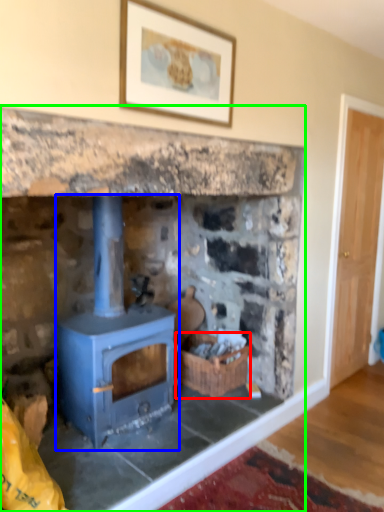
Question: Considering the real-world distances, which object is closest to basket (highlighted by a red box)? wood burning stove (highlighted by a blue box) or fireplace (highlighted by a green box).

Choices:
 (A) wood burning stove
 (B) fireplace

Answer: (B)